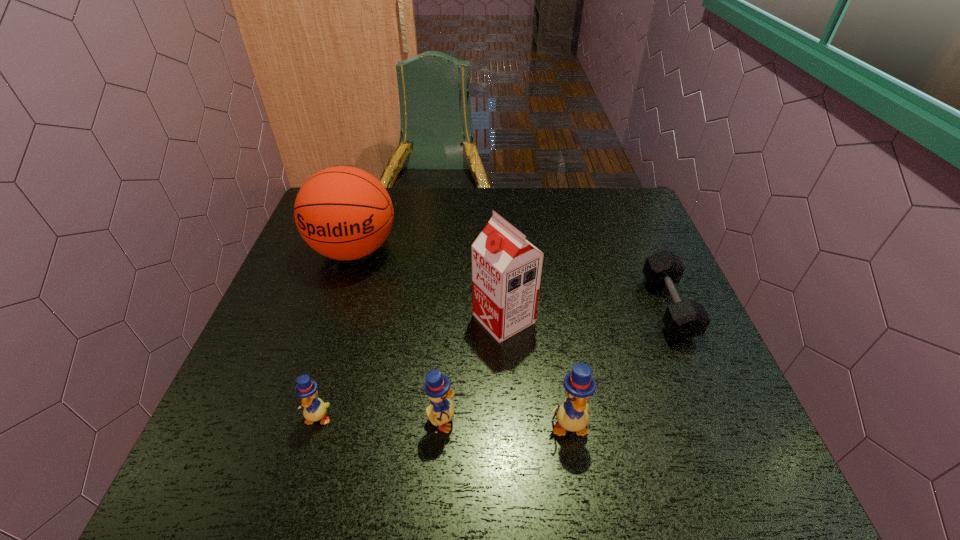
In the image, there is a desktop. In order to click on vacant region at the far right corner in this screenshot , I will do (595, 192).

Where is `blank area at the near right corner`? blank area at the near right corner is located at coordinates (678, 396).

You are a GUI agent. You are given a task and a screenshot of the screen. Output one action in this format:
    pyautogui.click(x=<x>, y=<y>)
    Task: Click on the empty space between the soya milk and the rightmost object
    
    Given the screenshot: What is the action you would take?
    pyautogui.click(x=586, y=313)

Image resolution: width=960 pixels, height=540 pixels. Identify the location of free area in between the shortest object and the rightmost duckling. (618, 366).

Where is `vacant area between the second tallest duckling and the basketball`? The height and width of the screenshot is (540, 960). vacant area between the second tallest duckling and the basketball is located at coordinates (397, 335).

Find the location of a particular element. The width and height of the screenshot is (960, 540). free space between the shortest object and the second object from right to left is located at coordinates (618, 366).

Where is `free spot between the basketball and the third object from left to right`? This screenshot has width=960, height=540. free spot between the basketball and the third object from left to right is located at coordinates (397, 335).

Where is `vacant space in between the second object from right to left and the basketball`? The height and width of the screenshot is (540, 960). vacant space in between the second object from right to left and the basketball is located at coordinates click(461, 338).

What are the coordinates of `free space between the fourth object from right to left and the fourth object from left to right` in the screenshot? It's located at (472, 370).

The width and height of the screenshot is (960, 540). I want to click on empty space that is in between the fourth object from right to left and the rightmost duckling, so (x=505, y=423).